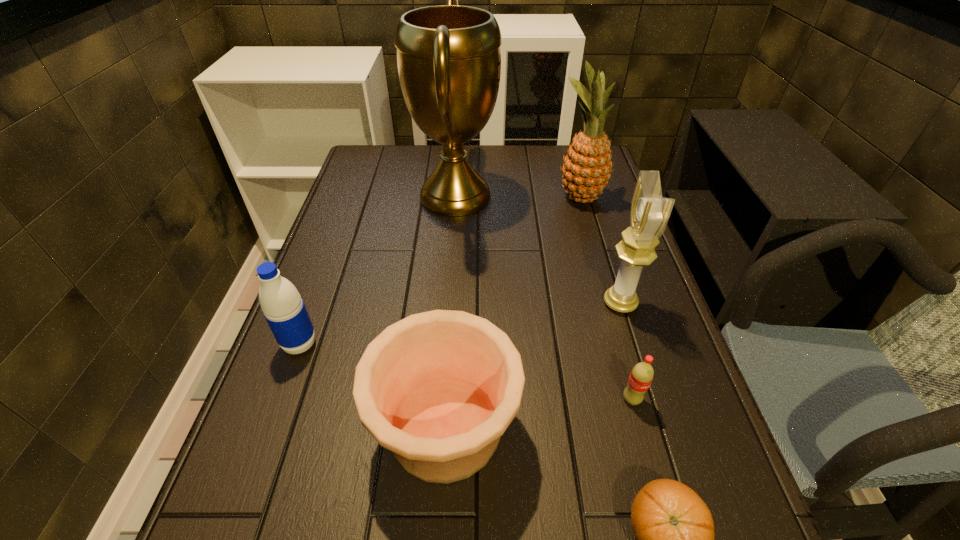
The image size is (960, 540). I want to click on the tallest object, so click(x=449, y=61).

At what (x,y) coordinates should I click in order to perform the action: click on pineapple. Please return your answer as a coordinate pair (x, y). This screenshot has height=540, width=960. Looking at the image, I should click on (586, 170).

At what (x,y) coordinates should I click in order to perform the action: click on the third tallest object. Please return your answer as a coordinate pair (x, y). The image size is (960, 540). Looking at the image, I should click on (649, 214).

Find the location of `the third farthest object`. the third farthest object is located at coordinates (649, 214).

Image resolution: width=960 pixels, height=540 pixels. I want to click on the leftmost object, so click(283, 308).

In order to click on the fourth farthest object in this screenshot , I will do `click(283, 308)`.

Image resolution: width=960 pixels, height=540 pixels. Find the location of `the third shortest object`. the third shortest object is located at coordinates (438, 389).

At what (x,y) coordinates should I click in order to perform the action: click on soda. Please return your answer as a coordinate pair (x, y). The width and height of the screenshot is (960, 540). Looking at the image, I should click on (642, 374).

Find the location of a particular element. vacant space located on the surface of the trophy cup with symbols is located at coordinates (537, 196).

You are a GUI agent. You are given a task and a screenshot of the screen. Output one action in this format:
    pyautogui.click(x=<x>, y=<y>)
    Task: Click on the free space located on the left of the pineapple
    This screenshot has width=960, height=540.
    Given the screenshot: What is the action you would take?
    pyautogui.click(x=444, y=198)